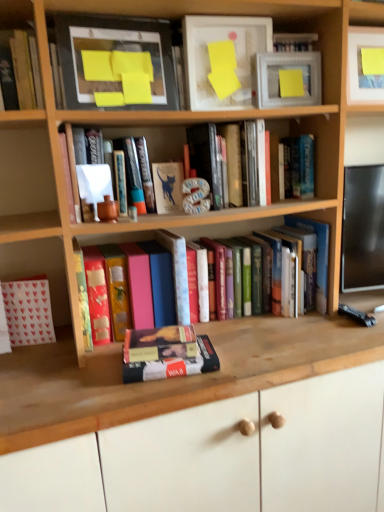
Find the location of a particular element. The width and height of the screenshot is (384, 512). free location in front of white paper bag at lower left, the fifth book positioned from the right is located at coordinates (32, 361).